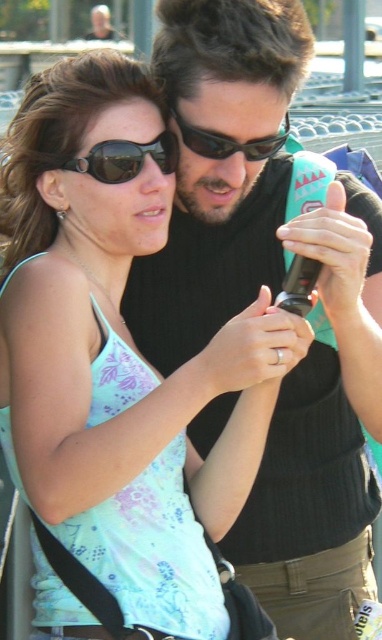
You are a photographer trying to capture a candid shot of both individuals without them noticing. The matte black sunglasses at upper left and sunglasses at center are in your frame. Which pair of sunglasses should you focus on to ensure they appear larger in your photo?

The matte black sunglasses at upper left should be focused on because they are much taller than the sunglasses at center, making them appear larger in the photo.